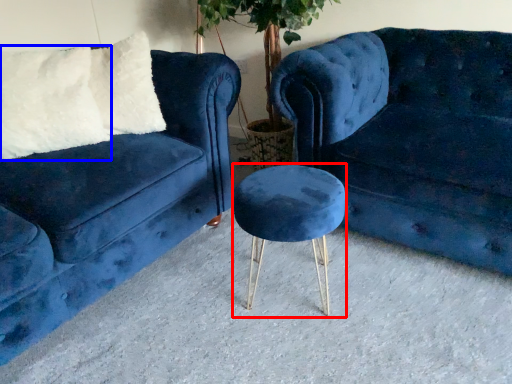
Question: Which of the following is the farthest to the observer, bar stool (highlighted by a red box) or pillow (highlighted by a blue box)?

Choices:
 (A) bar stool
 (B) pillow

Answer: (B)